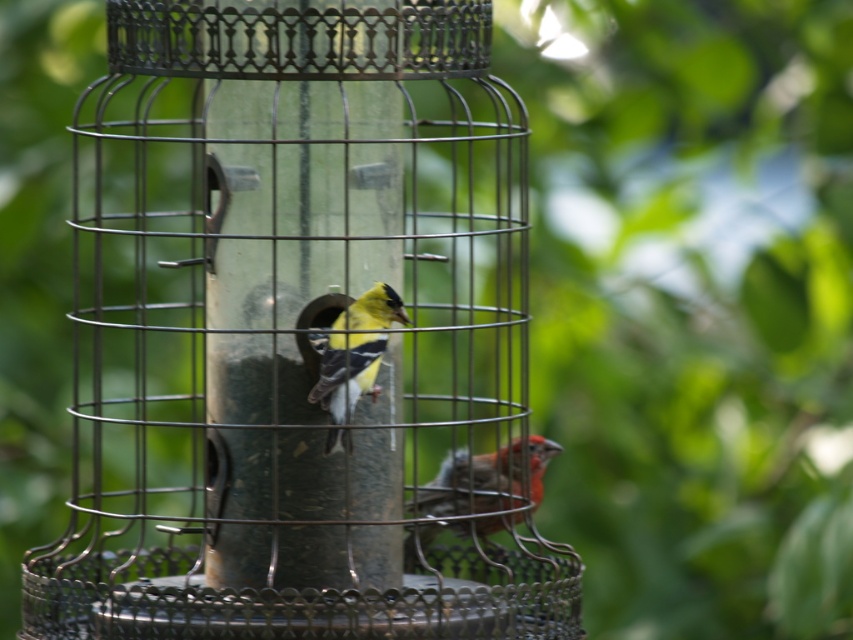
Does metallic wire bird feeder at center have a lesser width compared to yellow matte bird at center?

No.

Between point (352, 556) and point (312, 346), which one is positioned in front?

Point (352, 556) is in front.

Is point (281, 528) behind point (386, 294)?

No, (281, 528) is in front of (386, 294).

Locate an element on the screen. The width and height of the screenshot is (853, 640). metallic wire bird feeder at center is located at coordinates (300, 333).

Does metallic wire bird feeder at center appear on the left side of matte red bird at lower right?

Indeed, metallic wire bird feeder at center is positioned on the left side of matte red bird at lower right.

Which of these two, metallic wire bird feeder at center or matte red bird at lower right, stands shorter?

Standing shorter between the two is matte red bird at lower right.

Is point (277, 364) more distant than point (494, 476)?

No, it is not.

The height and width of the screenshot is (640, 853). Find the location of `metallic wire bird feeder at center`. metallic wire bird feeder at center is located at coordinates (300, 333).

Does matte red bird at lower right lie behind yellow matte bird at center?

That is True.

Can you confirm if matte red bird at lower right is thinner than yellow matte bird at center?

Incorrect, matte red bird at lower right's width is not less than yellow matte bird at center's.

Locate an element on the screen. This screenshot has width=853, height=640. matte red bird at lower right is located at coordinates (486, 480).